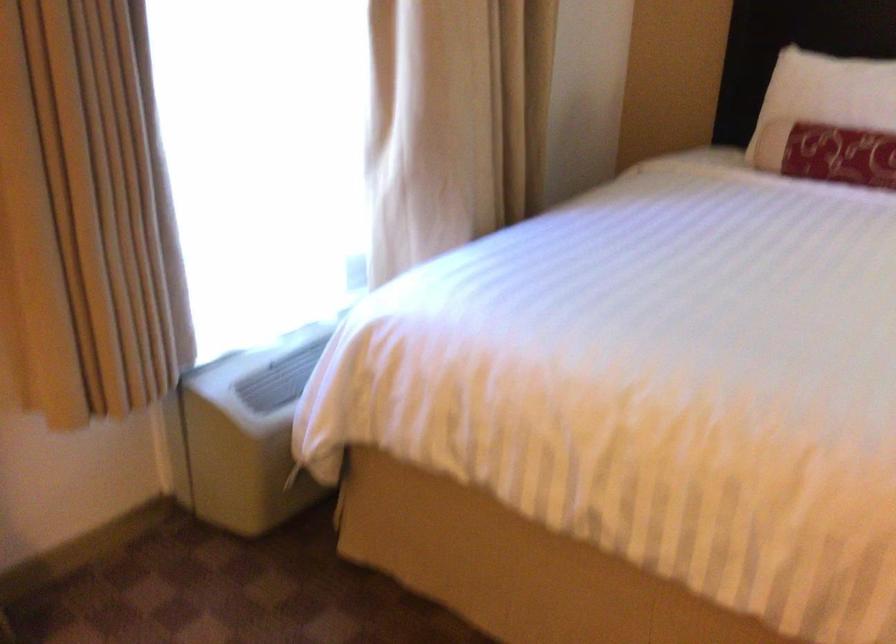
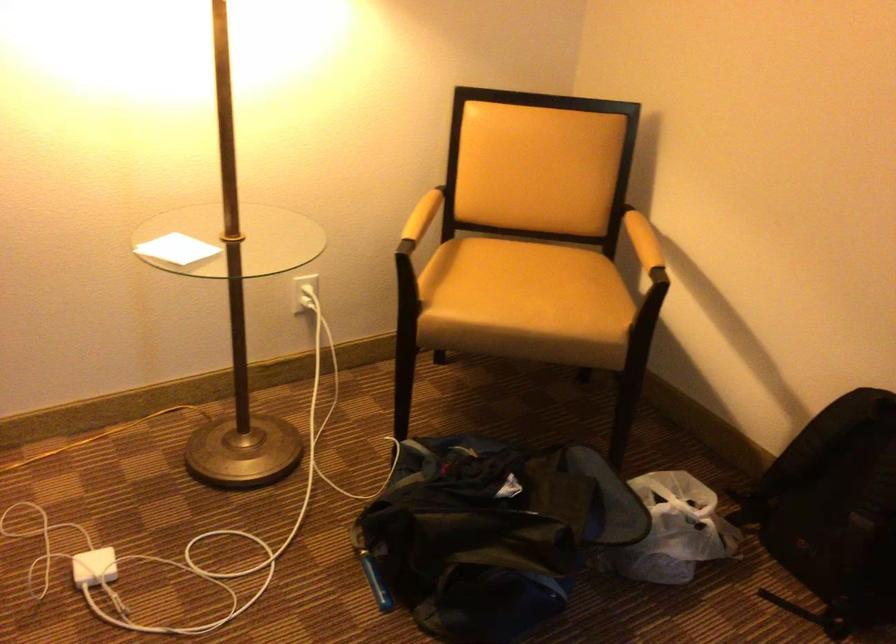
Looking at this image, first-person continuous shooting, in which direction is the camera rotating?

The camera rotated toward left-down.